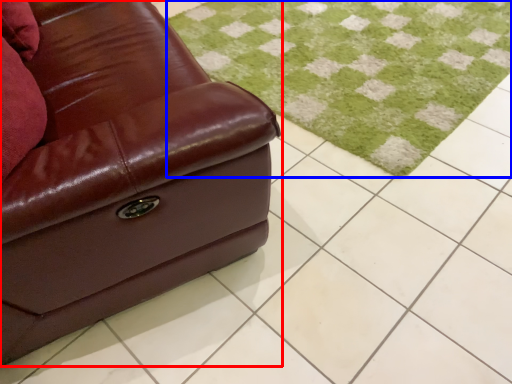
Question: Which point is closer to the camera, studio couch (highlighted by a red box) or grass (highlighted by a blue box)?

Choices:
 (A) studio couch
 (B) grass

Answer: (A)